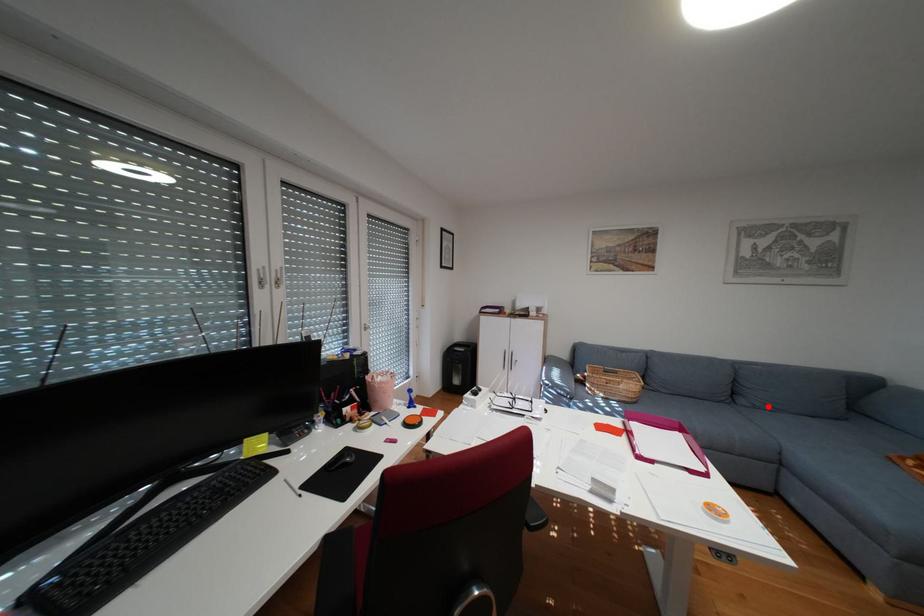
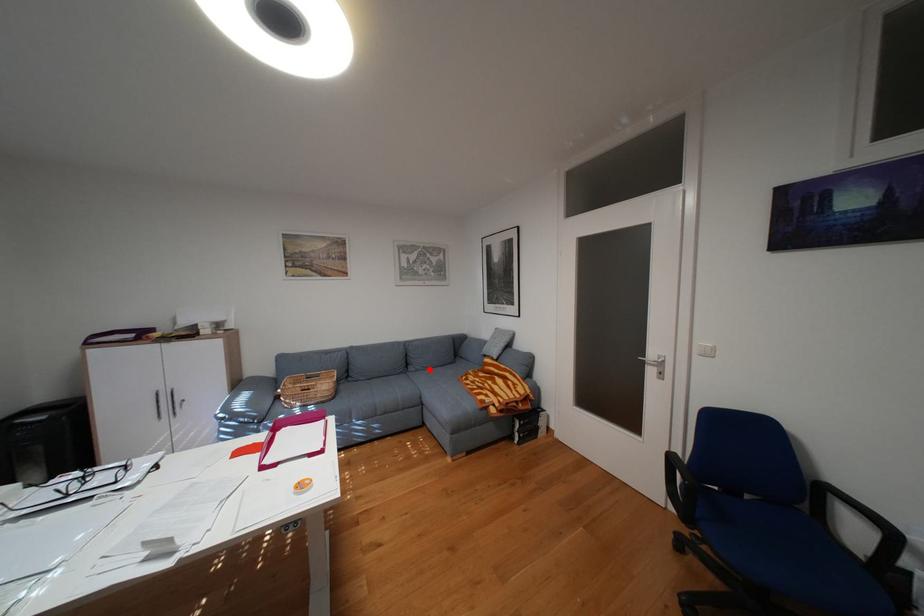
I am providing you with two images of the same scene from different viewpoints. A red point is marked on the first image and another point is marked on the second image. Does the point marked in image1 correspond to the same location as the one in image2?

Yes